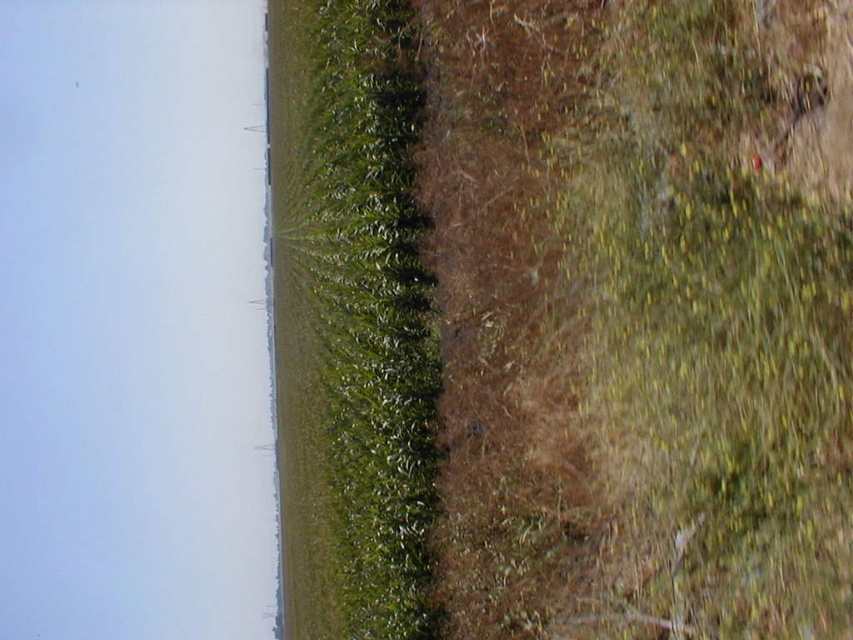
You are standing at the point labeled point (292, 99) and want to walk towards the point labeled point (381, 339). Which direction should you face to move towards it?

Since point (381, 339) is closer to the viewer than point (292, 99), you should face towards the direction of the green crops on the left side to move towards it.

You are standing at the point marked at coordinates (564, 317) in the image. Looking around, you see a field of tall green crops on the left and dry brown grass on the right. Which direction should you walk to reach the cultivated green crops?

You should walk to the left to reach the cultivated green crops because the green crops are on the left side of the image, and you are currently at the point marked at coordinates (564, 317), which is where the green grass at center is located.